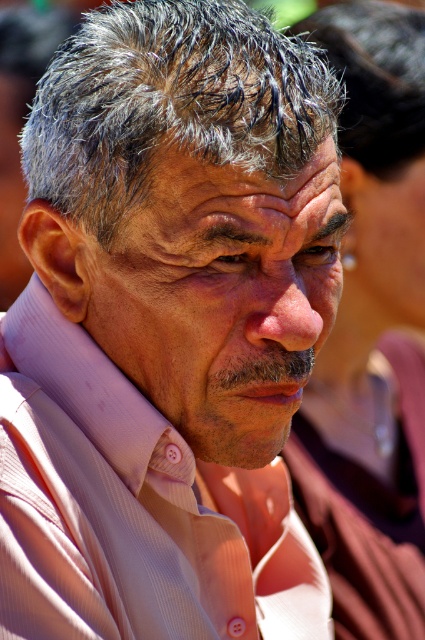
Is matte pink shirt at center above gray matte hair at center?

Incorrect, matte pink shirt at center is not positioned above gray matte hair at center.

Which is behind, point (212, 285) or point (146, 76)?

Positioned behind is point (212, 285).

Locate an element on the screen. The width and height of the screenshot is (425, 640). matte pink shirt at center is located at coordinates (218, 296).

Between pink striped dress shirt at center and matte pink shirt at center, which one appears on the right side from the viewer's perspective?

Positioned to the right is matte pink shirt at center.

Can you confirm if pink striped dress shirt at center is thinner than matte pink shirt at center?

Incorrect, pink striped dress shirt at center's width is not less than matte pink shirt at center's.

Which is in front, point (57, 620) or point (303, 321)?

Point (57, 620) is in front.

Identify the location of pink striped dress shirt at center. (x=133, y=509).

Is pink striped dress shirt at center to the right of dark brown curly hair at upper center from the viewer's perspective?

Incorrect, pink striped dress shirt at center is not on the right side of dark brown curly hair at upper center.

Is point (294, 529) less distant than point (376, 3)?

Yes, it is.

Identify the location of pink striped dress shirt at center. This screenshot has width=425, height=640. (133, 509).

Identify the location of pink striped dress shirt at center. The width and height of the screenshot is (425, 640). (133, 509).